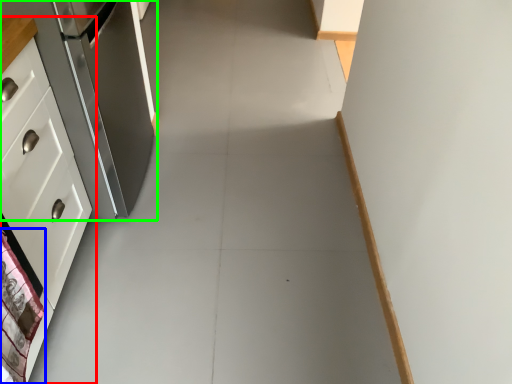
Question: Estimate the real-world distances between objects in this image. Which object is farther from cabinetry (highlighted by a red box), material (highlighted by a blue box) or refrigerator (highlighted by a green box)?

Choices:
 (A) material
 (B) refrigerator

Answer: (B)